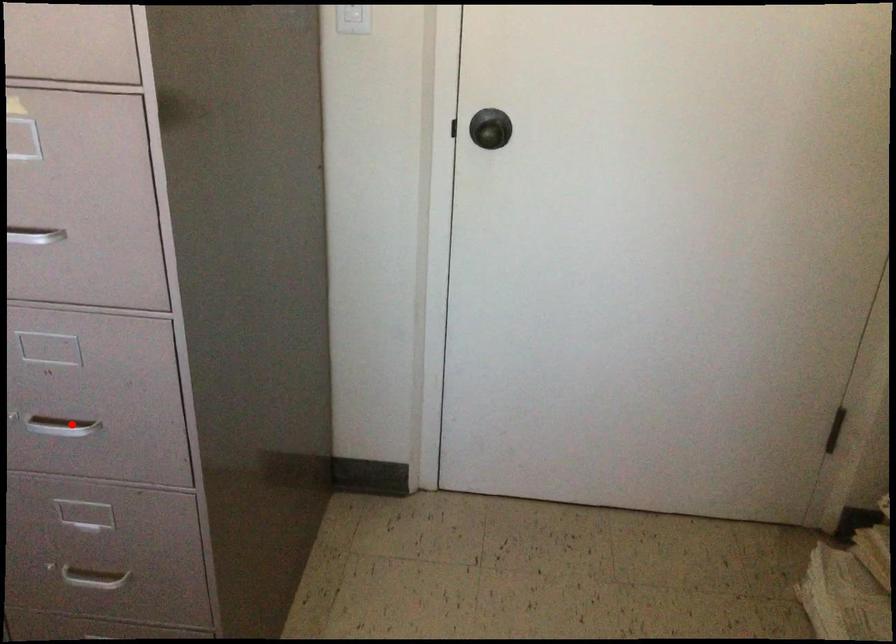
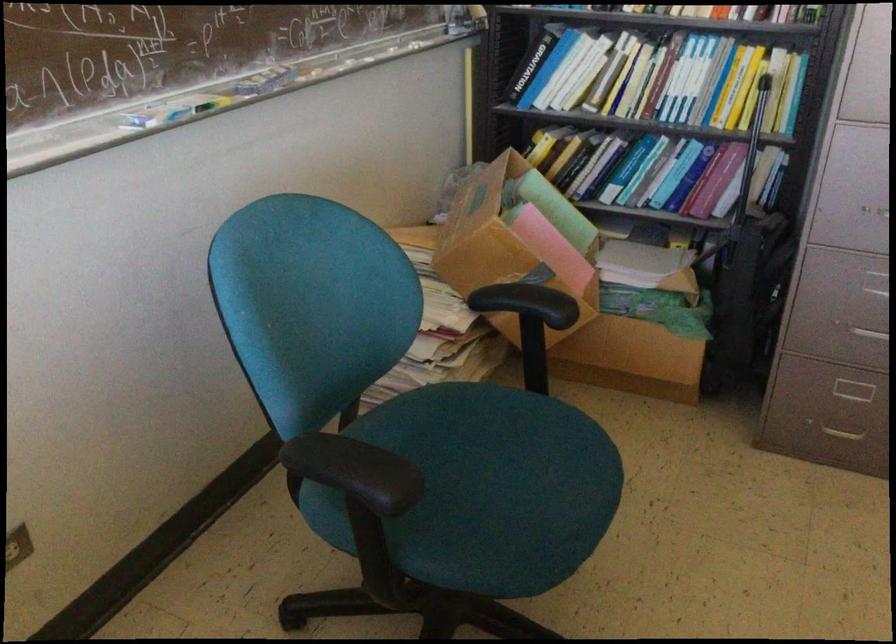
Where in the second image is the point corresponding to the highlighted location from the first image?

(877, 214)